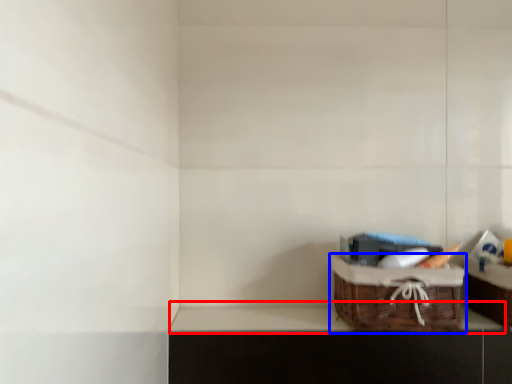
Question: Which of the following is the farthest to the observer, window sill (highlighted by a red box) or picnic basket (highlighted by a blue box)?

Choices:
 (A) window sill
 (B) picnic basket

Answer: (A)